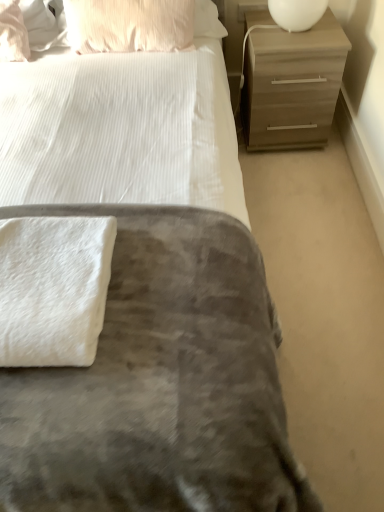
Where is `free space to the left of white glossy lampshade at upper right`? The height and width of the screenshot is (512, 384). free space to the left of white glossy lampshade at upper right is located at coordinates (256, 32).